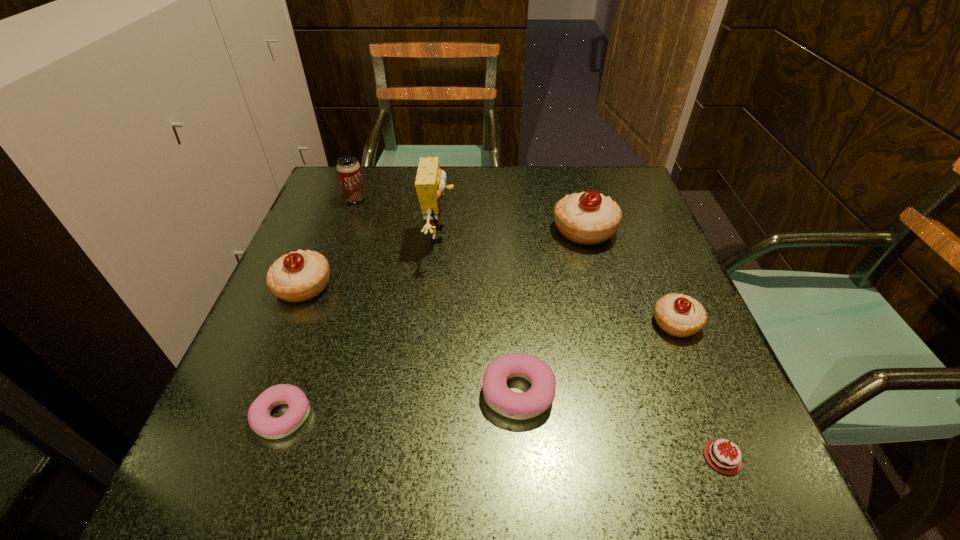
Identify the location of blank space located on the back of the bigger pink pastry. Image resolution: width=960 pixels, height=540 pixels. (512, 300).

In order to click on free point located on the right of the shortest pastry in this screenshot , I will do `click(439, 416)`.

Find the location of a particular element. vacant area situated 0.300m on the back of the chocolate cake is located at coordinates (655, 287).

The width and height of the screenshot is (960, 540). Identify the location of sponge that is positioned at the far edge. pos(430,183).

The height and width of the screenshot is (540, 960). Find the location of `pastry that is positioned at the far edge`. pastry that is positioned at the far edge is located at coordinates (588, 218).

Identify the location of beer can present at the far edge. (349, 171).

Identify the location of pastry positioned at the near edge. 260,421.

Locate an element on the screen. This screenshot has width=960, height=540. chocolate cake situated at the near edge is located at coordinates (723, 461).

At what (x,y) coordinates should I click in order to perform the action: click on beer can at the left edge. Please return your answer as a coordinate pair (x, y). Image resolution: width=960 pixels, height=540 pixels. Looking at the image, I should click on (349, 171).

Identify the location of chocolate cake situated at the right edge. (723, 461).